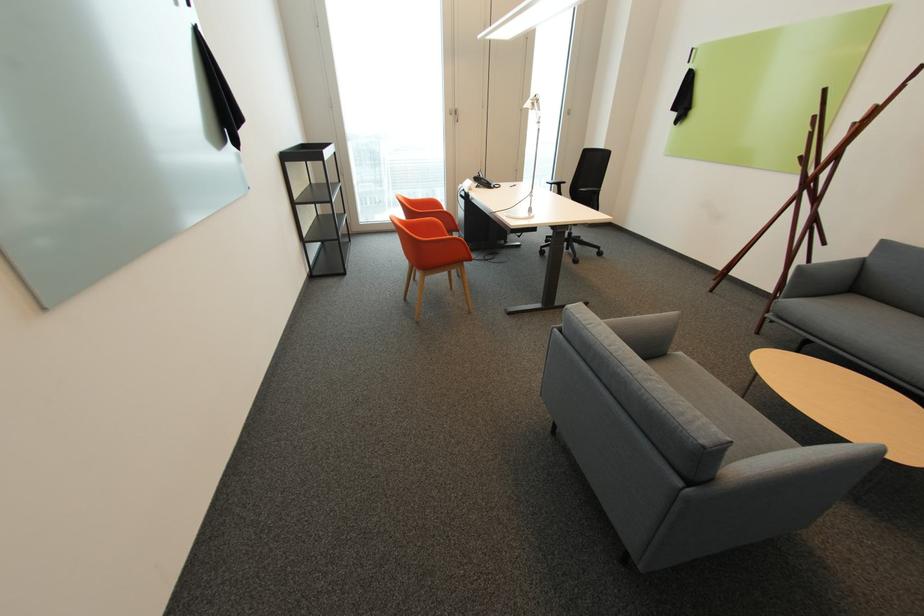
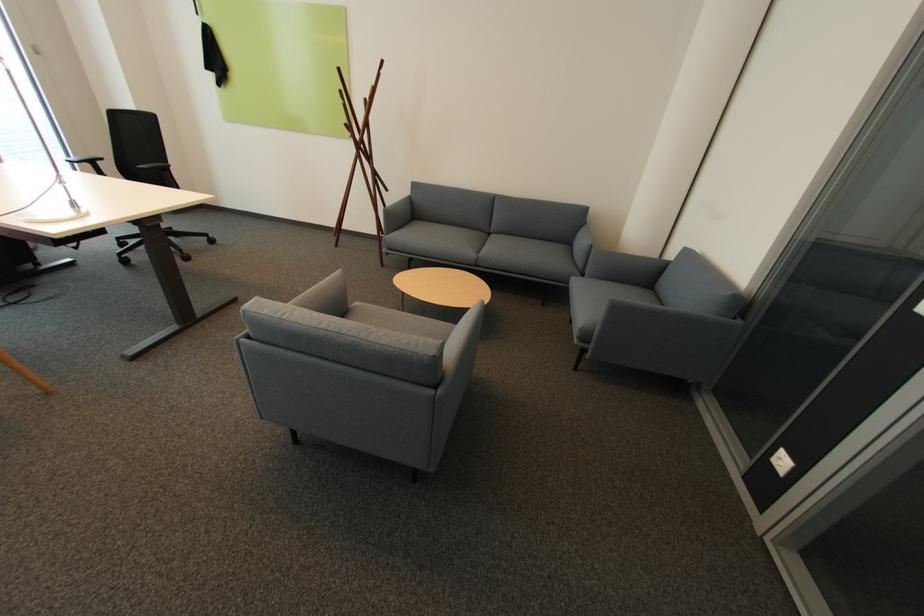
The point at (687, 354) is marked in the first image. Where is the corresponding point in the second image?

(362, 304)